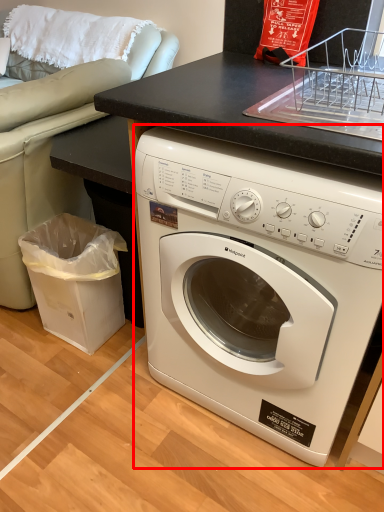
Question: From the image's perspective, what is the correct spatial relationship of washing machine (annotated by the red box) in relation to garbage?

Choices:
 (A) above
 (B) below

Answer: (A)